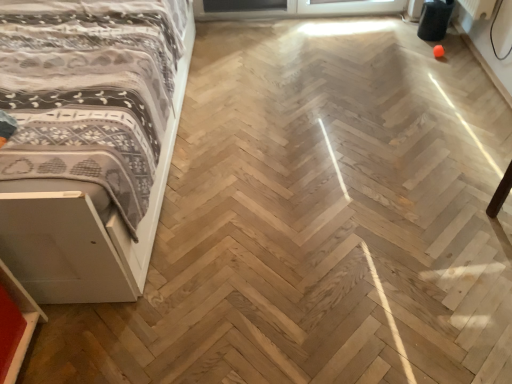
I want to click on white matte bed at left, so click(x=87, y=169).

The width and height of the screenshot is (512, 384). Describe the element at coordinates (87, 169) in the screenshot. I see `white matte bed at left` at that location.

Measure the distance between white matte bed at left and camera.

white matte bed at left is 1.12 meters from camera.

I want to click on white matte bed at left, so click(x=87, y=169).